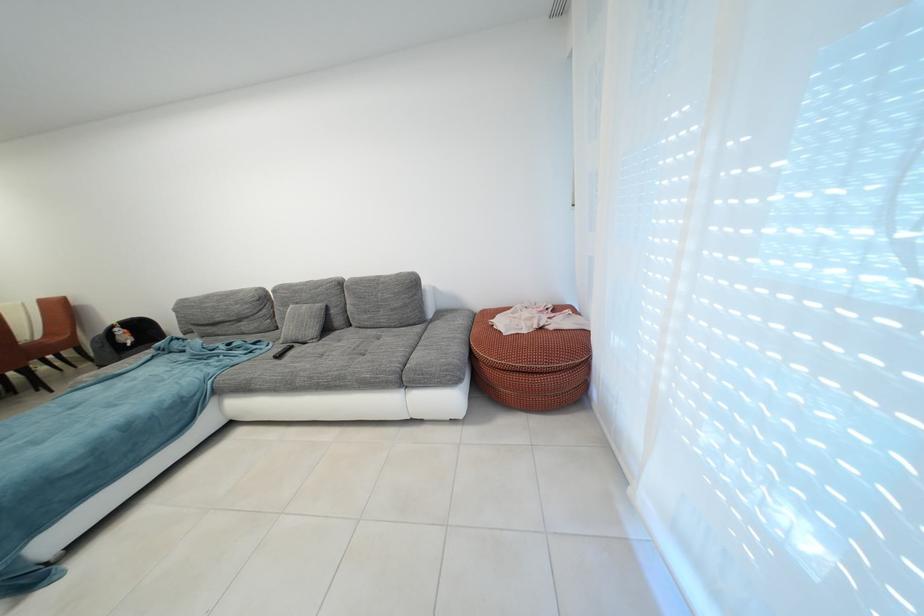
The width and height of the screenshot is (924, 616). Find the location of `sofa sitting surface`. sofa sitting surface is located at coordinates (325, 362).